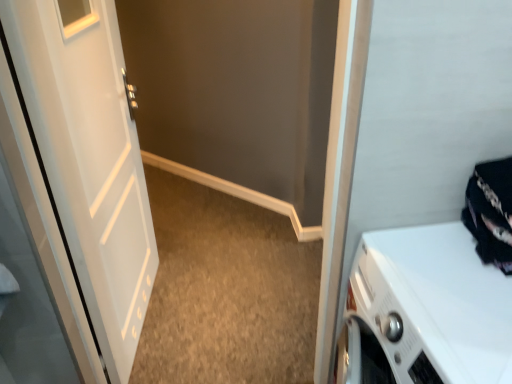
Question: Is black fabric at right facing away from white matte door at left?

Choices:
 (A) yes
 (B) no

Answer: (B)

Question: Does black fabric at right touch white matte door at left?

Choices:
 (A) no
 (B) yes

Answer: (A)

Question: Is black fabric at right aimed at white matte door at left?

Choices:
 (A) no
 (B) yes

Answer: (A)

Question: From a real-world perspective, is black fabric at right over white matte door at left?

Choices:
 (A) yes
 (B) no

Answer: (A)

Question: Does black fabric at right have a smaller size compared to white matte door at left?

Choices:
 (A) yes
 (B) no

Answer: (A)

Question: Does black fabric at right have a lesser height compared to white matte door at left?

Choices:
 (A) no
 (B) yes

Answer: (B)

Question: Can you confirm if white glossy washing machine at lower right is wider than white matte door at left?

Choices:
 (A) yes
 (B) no

Answer: (A)

Question: Is white glossy washing machine at lower right at the left side of white matte door at left?

Choices:
 (A) no
 (B) yes

Answer: (A)

Question: From a real-world perspective, is white glossy washing machine at lower right below white matte door at left?

Choices:
 (A) yes
 (B) no

Answer: (A)

Question: Is white glossy washing machine at lower right closer to camera compared to white matte door at left?

Choices:
 (A) yes
 (B) no

Answer: (A)

Question: From the image's perspective, is white glossy washing machine at lower right beneath white matte door at left?

Choices:
 (A) no
 (B) yes

Answer: (B)

Question: Considering the relative sizes of white glossy washing machine at lower right and white matte door at left in the image provided, is white glossy washing machine at lower right shorter than white matte door at left?

Choices:
 (A) yes
 (B) no

Answer: (A)

Question: Is white matte door at left positioned before white glossy washing machine at lower right?

Choices:
 (A) no
 (B) yes

Answer: (A)